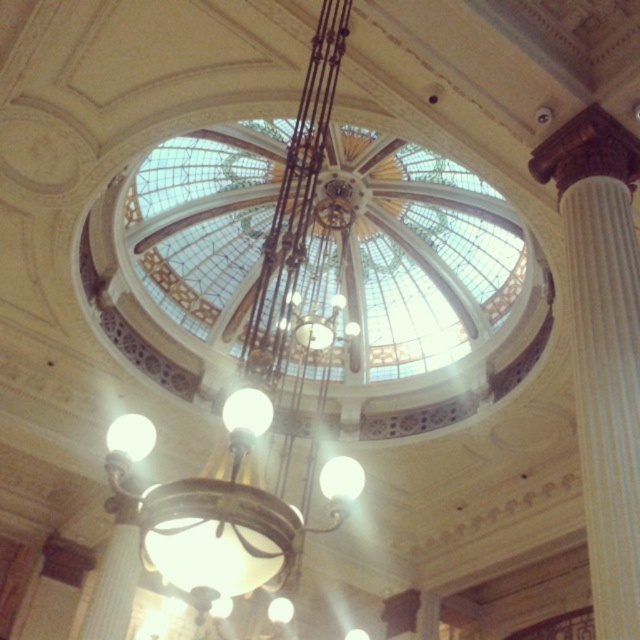
Is metallic chandelier at center wider than white marble column at right?

Indeed, metallic chandelier at center has a greater width compared to white marble column at right.

Does metallic chandelier at center appear over white marble column at right?

No, metallic chandelier at center is not above white marble column at right.

Locate an element on the screen. This screenshot has height=640, width=640. metallic chandelier at center is located at coordinates (252, 387).